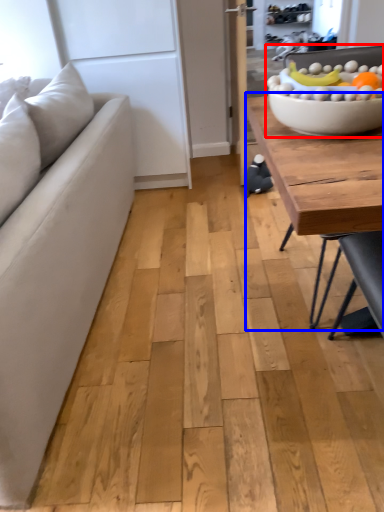
Question: Which object appears farthest to the camera in this image, bowl (highlighted by a red box) or coffee table (highlighted by a blue box)?

Choices:
 (A) bowl
 (B) coffee table

Answer: (B)